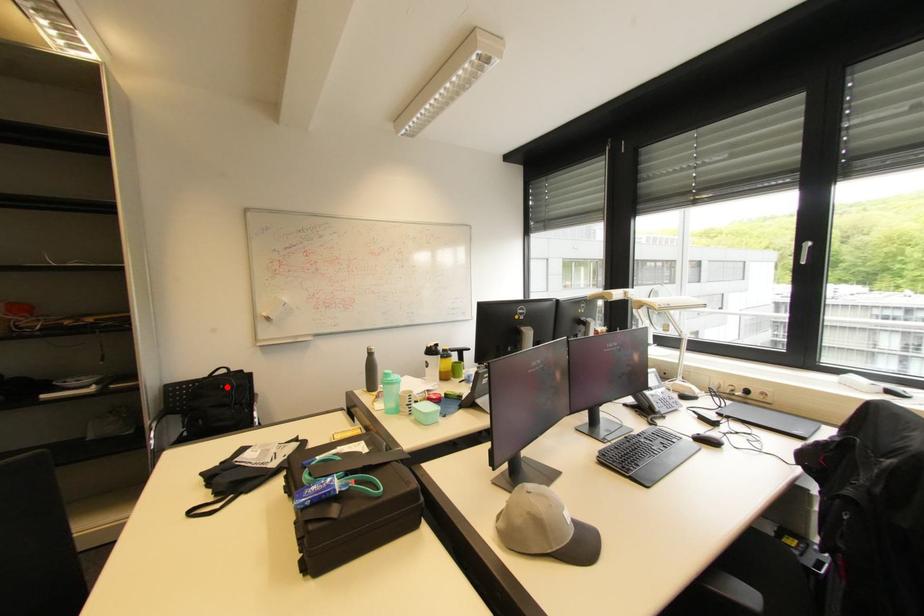
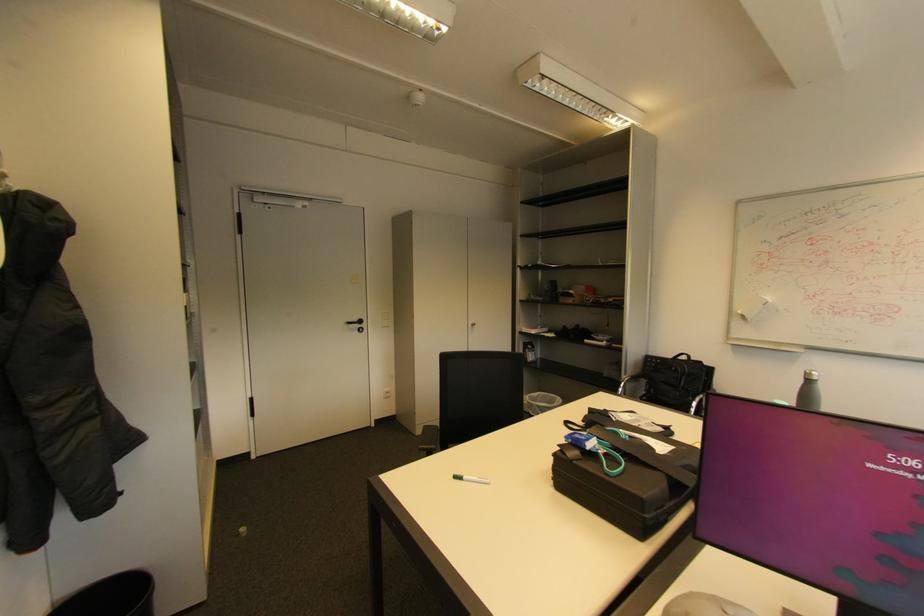
Where in the second image is the point corresponding to the highlighted location from the first image?

(678, 369)